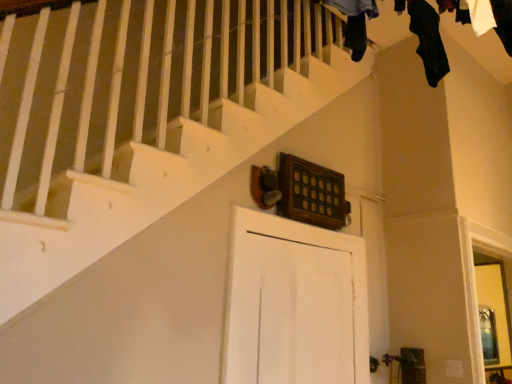
Question: Is black fabric at upper center, which is counted as the second clothing, starting from the right, shorter than black fabric at upper right, the 2th clothing from the front?

Choices:
 (A) yes
 (B) no

Answer: (A)

Question: Is black fabric at upper center, the 1th clothing viewed from the front, at the right side of black fabric at upper right, the 1th clothing in the back-to-front sequence?

Choices:
 (A) no
 (B) yes

Answer: (A)

Question: Is black fabric at upper center, positioned as the first clothing in left-to-right order, behind black fabric at upper right, the 2th clothing from the front?

Choices:
 (A) no
 (B) yes

Answer: (A)

Question: Is black fabric at upper center, the 1th clothing viewed from the front, thinner than black fabric at upper right, the 1th clothing in the back-to-front sequence?

Choices:
 (A) no
 (B) yes

Answer: (A)

Question: Is black fabric at upper center, positioned as the first clothing in left-to-right order, wider than black fabric at upper right, the 1th clothing in the back-to-front sequence?

Choices:
 (A) no
 (B) yes

Answer: (B)

Question: From a real-world perspective, is black fabric at upper center, the 1th clothing viewed from the front, positioned over black fabric at upper right, acting as the 1th clothing starting from the right, based on gravity?

Choices:
 (A) no
 (B) yes

Answer: (A)

Question: From a real-world perspective, is white matte door at center physically below black fabric at upper right, acting as the 1th clothing starting from the right?

Choices:
 (A) yes
 (B) no

Answer: (A)

Question: Can you confirm if white matte door at center is shorter than black fabric at upper right, the 1th clothing in the back-to-front sequence?

Choices:
 (A) no
 (B) yes

Answer: (A)

Question: Is white matte door at center to the right of black fabric at upper right, the 1th clothing in the back-to-front sequence, from the viewer's perspective?

Choices:
 (A) no
 (B) yes

Answer: (A)

Question: From the image's perspective, is white matte door at center over black fabric at upper right, the 1th clothing in the back-to-front sequence?

Choices:
 (A) no
 (B) yes

Answer: (A)

Question: Is white matte door at center looking in the opposite direction of black fabric at upper right, acting as the 1th clothing starting from the right?

Choices:
 (A) yes
 (B) no

Answer: (B)

Question: Is white matte door at center positioned before black fabric at upper right, acting as the 1th clothing starting from the right?

Choices:
 (A) yes
 (B) no

Answer: (A)

Question: Does black fabric at upper right, the 2th clothing from the front, have a greater height compared to black fabric at upper center, which is counted as the second clothing, starting from the right?

Choices:
 (A) yes
 (B) no

Answer: (A)